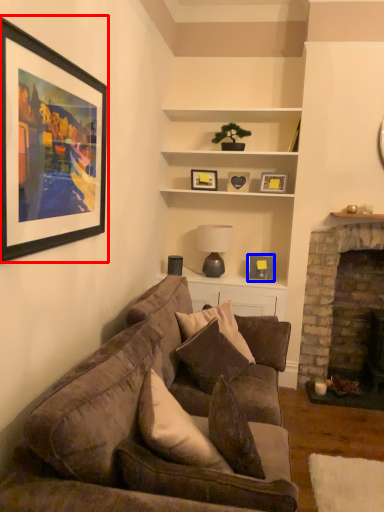
Question: Among these objects, which one is farthest to the camera, picture frame (highlighted by a red box) or picture frame (highlighted by a blue box)?

Choices:
 (A) picture frame
 (B) picture frame

Answer: (B)